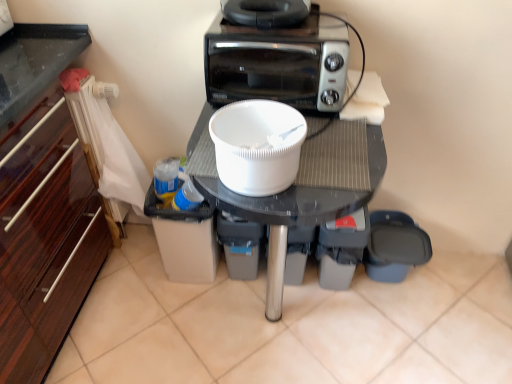
Find the location of a particular element. This screenshot has height=384, width=512. free area below white plastic table at center (from a real-world perspective) is located at coordinates (273, 327).